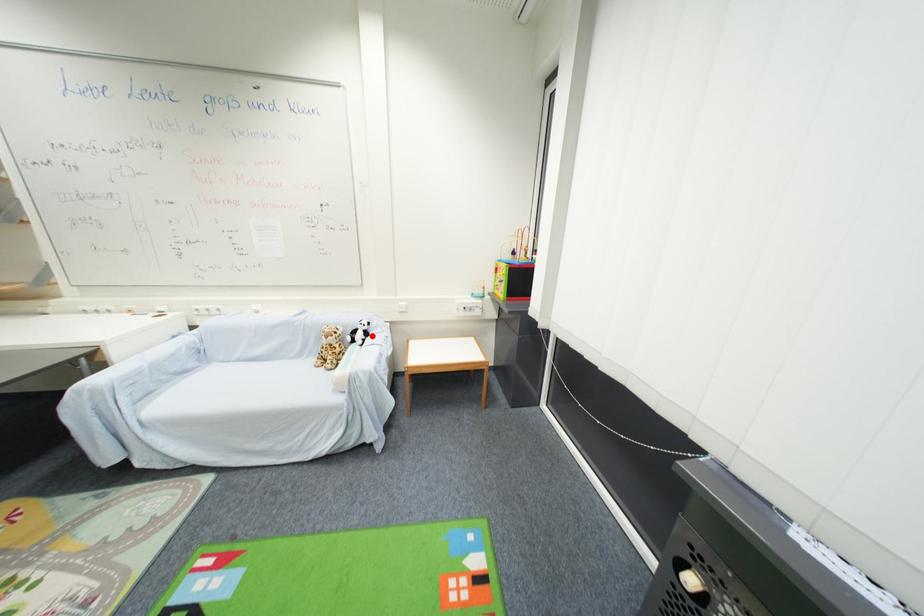
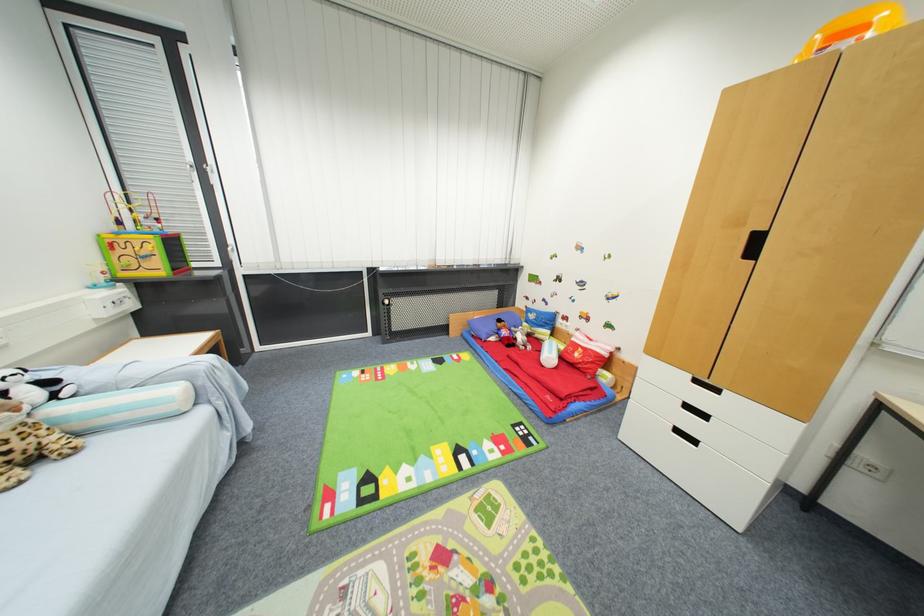
Where in the second image is the point corresponding to the highlighted location from the first image?

(54, 384)